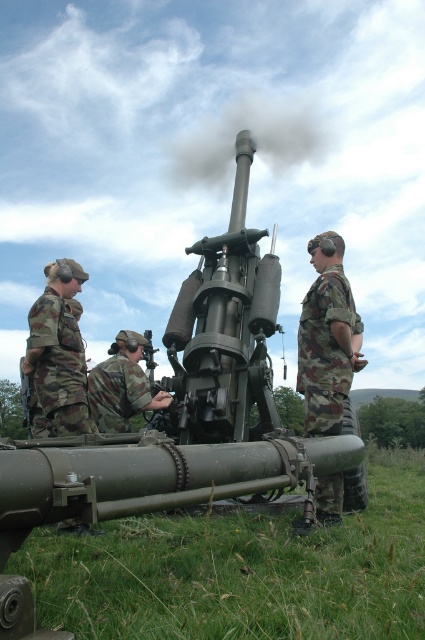
Consider the image. You are a military analyst observing the scene. You notice the matte green cannon at center and the camo fabric soldier at center. Which object is closer to your viewpoint?

The matte green cannon at center is closer to the viewer than the camo fabric soldier at center.

You are a soldier positioned at the artillery piece. You need to move to a specific point in the field. The coordinates given are point 1 at point [85,280] and point 2 at point [104,392]. Which point is closer to the artillery piece?

Point 1 at point [85,280] is closer to the artillery piece because it is in front of point 2 at point [104,392], meaning it is nearer to the observer.